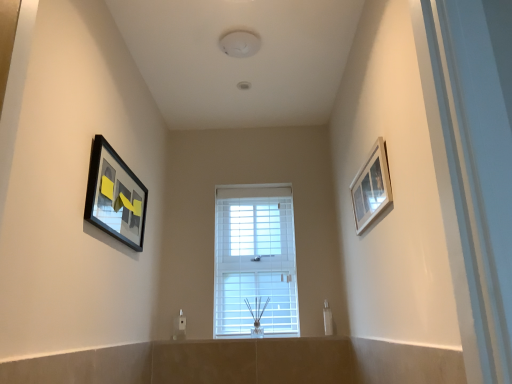
Question: Considering the relative sizes of white matte window at center and matte black picture frame at left, the 1th picture frame viewed from the left, in the image provided, is white matte window at center taller than matte black picture frame at left, the 1th picture frame viewed from the left,?

Choices:
 (A) yes
 (B) no

Answer: (A)

Question: Is white matte window at center far away from matte black picture frame at left, the 1th picture frame viewed from the left?

Choices:
 (A) no
 (B) yes

Answer: (B)

Question: From a real-world perspective, does white matte window at center stand above matte black picture frame at left, the 1th picture frame viewed from the left?

Choices:
 (A) no
 (B) yes

Answer: (A)

Question: Is white matte window at center to the left of matte black picture frame at left, the second picture frame from the right, from the viewer's perspective?

Choices:
 (A) no
 (B) yes

Answer: (A)

Question: Does white matte window at center lie in front of matte black picture frame at left, the second picture frame from the right?

Choices:
 (A) yes
 (B) no

Answer: (B)

Question: Is white matte window at center not within matte black picture frame at left, the second picture frame from the right?

Choices:
 (A) no
 (B) yes

Answer: (B)

Question: Are matte black picture frame at left, the 1th picture frame viewed from the left, and white matte window at center beside each other?

Choices:
 (A) yes
 (B) no

Answer: (B)

Question: Does matte black picture frame at left, the 1th picture frame viewed from the left, have a greater width compared to white matte window at center?

Choices:
 (A) yes
 (B) no

Answer: (B)

Question: Is matte black picture frame at left, the 1th picture frame viewed from the left, surrounding white matte window at center?

Choices:
 (A) yes
 (B) no

Answer: (B)

Question: Is matte black picture frame at left, the 1th picture frame viewed from the left, looking in the opposite direction of white matte window at center?

Choices:
 (A) yes
 (B) no

Answer: (B)

Question: Does matte black picture frame at left, the 1th picture frame viewed from the left, have a smaller size compared to white matte window at center?

Choices:
 (A) no
 (B) yes

Answer: (B)

Question: From a real-world perspective, is matte black picture frame at left, the 1th picture frame viewed from the left, positioned under white matte window at center based on gravity?

Choices:
 (A) yes
 (B) no

Answer: (B)

Question: Is white glossy picture frame at upper right, marked as the 1th picture frame in a right-to-left arrangement, at the left side of matte black picture frame at left, the second picture frame from the right?

Choices:
 (A) yes
 (B) no

Answer: (B)